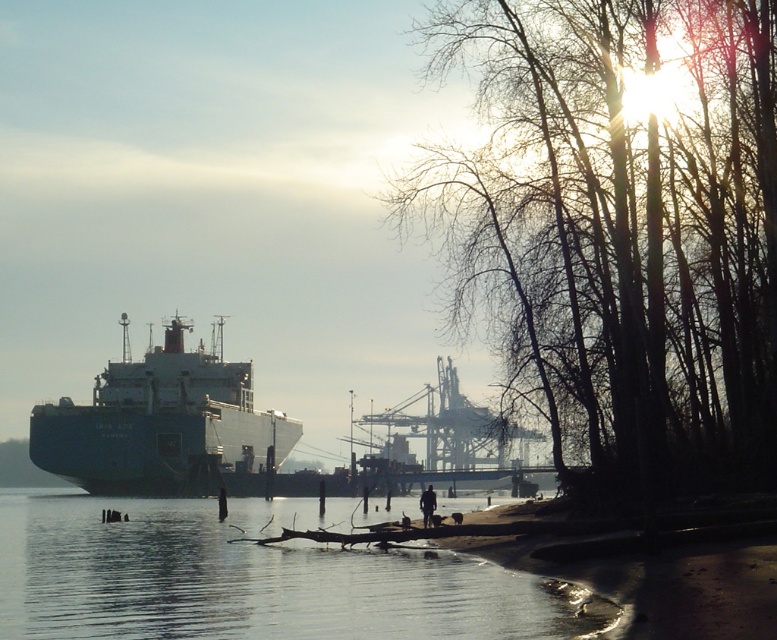
Question: Which point is farther from the camera taking this photo?

Choices:
 (A) (106, 420)
 (B) (410, 508)
 (C) (559, 244)

Answer: (A)

Question: Does blue matte cargo ship at left come in front of dark brown leather jacket at center?

Choices:
 (A) no
 (B) yes

Answer: (A)

Question: Which object is the closest to the smooth water at lower left?

Choices:
 (A) blue matte cargo ship at left
 (B) dark brown leather jacket at center
 (C) silhouette bare trees at right

Answer: (C)

Question: Where is blue matte cargo ship at left located in relation to dark brown leather jacket at center in the image?

Choices:
 (A) below
 (B) above

Answer: (B)

Question: Does smooth water at lower left come in front of dark brown leather jacket at center?

Choices:
 (A) no
 (B) yes

Answer: (B)

Question: Which is farther from the dark brown leather jacket at center?

Choices:
 (A) silhouette bare trees at right
 (B) smooth water at lower left

Answer: (B)